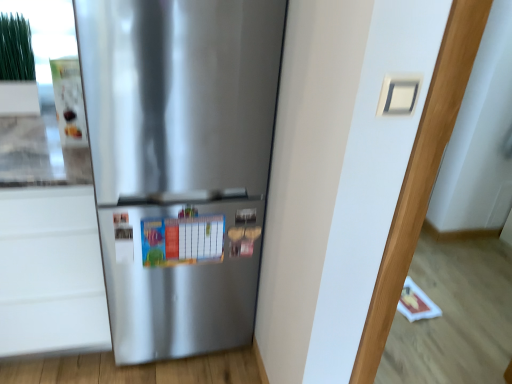
Question: In terms of height, does white matte drawer at lower left look taller or shorter compared to satin silver refrigerator at center?

Choices:
 (A) short
 (B) tall

Answer: (A)

Question: Considering the positions of point (10, 349) and point (227, 23), is point (10, 349) closer or farther from the camera than point (227, 23)?

Choices:
 (A) farther
 (B) closer

Answer: (A)

Question: Which of these objects is positioned closest to the white matte drawer at lower left?

Choices:
 (A) white matte door at center
 (B) satin silver refrigerator at center

Answer: (B)

Question: Estimate the real-world distances between objects in this image. Which object is closer to the satin silver refrigerator at center?

Choices:
 (A) white matte door at center
 (B) white matte drawer at lower left

Answer: (B)